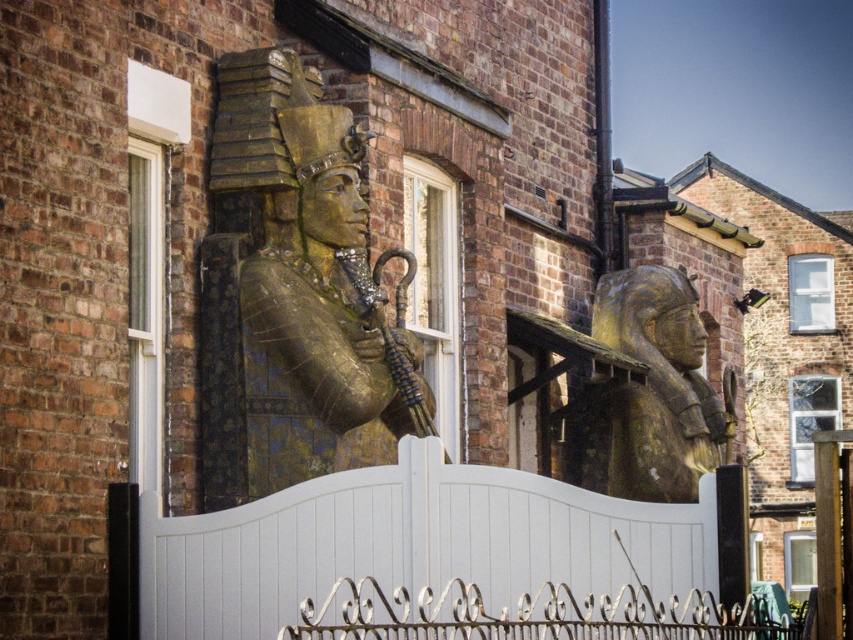
Does gold/gilded stone pharaoh at center have a lesser width compared to white painted wood gate at center?

Yes.

Between gold/gilded stone pharaoh at center and white painted wood gate at center, which one is positioned higher?

gold/gilded stone pharaoh at center is above.

This screenshot has height=640, width=853. What do you see at coordinates (296, 296) in the screenshot?
I see `gold/gilded stone pharaoh at center` at bounding box center [296, 296].

Where is `gold/gilded stone pharaoh at center`? The height and width of the screenshot is (640, 853). gold/gilded stone pharaoh at center is located at coordinates (296, 296).

Does gold/gilded stone pharaoh at center appear on the left side of gold/golden stone sphinx at center?

Yes, gold/gilded stone pharaoh at center is to the left of gold/golden stone sphinx at center.

Does point (311, 440) lie in front of point (616, 406)?

Yes.

Locate an element on the screen. The height and width of the screenshot is (640, 853). gold/gilded stone pharaoh at center is located at coordinates (296, 296).

Can you confirm if white painted wood gate at center is taller than gold/golden stone sphinx at center?

No, white painted wood gate at center is not taller than gold/golden stone sphinx at center.

Find the location of `white painted wood gate at center`. white painted wood gate at center is located at coordinates (410, 544).

Locate an element on the screen. white painted wood gate at center is located at coordinates (410, 544).